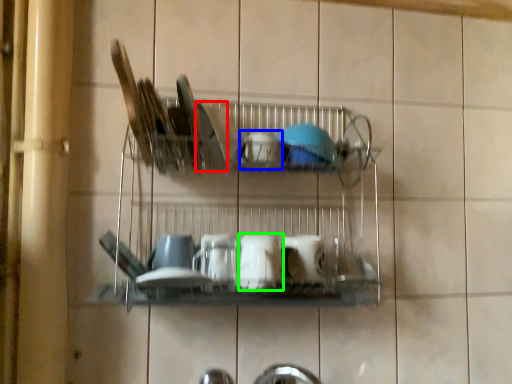
Question: Estimate the real-world distances between objects in this image. Which object is closer to tableware (highlighted by a red box), tableware (highlighted by a blue box) or tableware (highlighted by a green box)?

Choices:
 (A) tableware
 (B) tableware

Answer: (A)